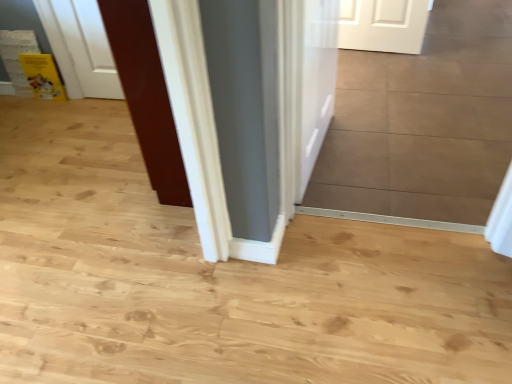
Question: Based on their sizes in the image, would you say glossy wood door at center, arranged as the first door when viewed from the left, is bigger or smaller than white glossy door at center, which is the second door from left to right?

Choices:
 (A) big
 (B) small

Answer: (A)

Question: In the image, is glossy wood door at center, arranged as the first door when viewed from the left, positioned in front of or behind white glossy door at center, which is the second door from left to right?

Choices:
 (A) front
 (B) behind

Answer: (B)

Question: Is glossy wood door at center, which is the 2th door in right-to-left order, inside or outside of white glossy door at center, which is the second door from left to right?

Choices:
 (A) outside
 (B) inside

Answer: (A)

Question: Considering the positions of point (306, 18) and point (168, 185), is point (306, 18) closer or farther from the camera than point (168, 185)?

Choices:
 (A) farther
 (B) closer

Answer: (B)

Question: Is white glossy door at center, which appears as the 1th door when viewed from the right, spatially inside glossy wood door at center, arranged as the first door when viewed from the left, or outside of it?

Choices:
 (A) outside
 (B) inside

Answer: (A)

Question: Looking at the image, does white glossy door at center, which is the second door from left to right, seem bigger or smaller compared to glossy wood door at center, which is the 2th door in right-to-left order?

Choices:
 (A) small
 (B) big

Answer: (A)

Question: From a real-world perspective, is white glossy door at center, which appears as the 1th door when viewed from the right, physically located above or below glossy wood door at center, arranged as the first door when viewed from the left?

Choices:
 (A) below
 (B) above

Answer: (A)